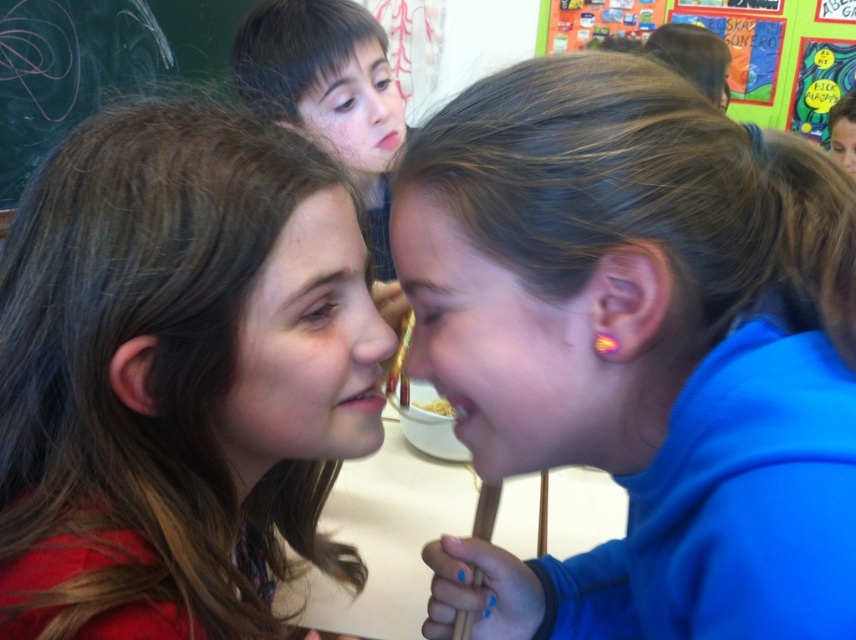
Question: Which object is the farthest from the blue fabric at center?

Choices:
 (A) brown hair at upper center
 (B) chalkboard at upper left
 (C) matte blue ear at center
 (D) brown hair at left

Answer: (B)

Question: Which is farther from the chalkboard at upper left?

Choices:
 (A) smooth skin face at upper center
 (B) matte blue hair at upper center
 (C) yellow matte pasta at center
 (D) matte blue ear at center

Answer: (B)

Question: Among these objects, which one is farthest from the camera?

Choices:
 (A) blue fabric at center
 (B) brown hair at upper center
 (C) matte brown hair at center
 (D) matte blue ear at center

Answer: (B)

Question: Can you confirm if matte brown hair at center is thinner than matte blue ear at center?

Choices:
 (A) no
 (B) yes

Answer: (B)

Question: Is brown hair at left to the right of matte blue hair at upper center from the viewer's perspective?

Choices:
 (A) yes
 (B) no

Answer: (B)

Question: Can you confirm if brown hair at left is positioned to the right of chalkboard at upper left?

Choices:
 (A) no
 (B) yes

Answer: (B)